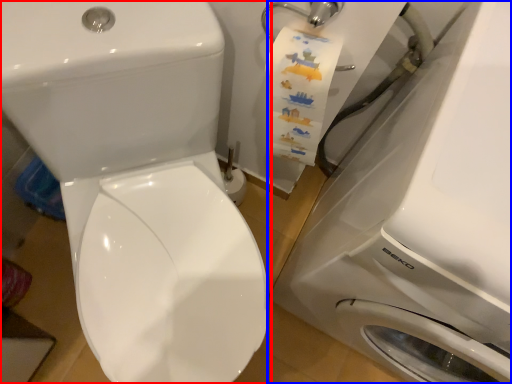
Question: Which object is closer to the camera taking this photo, toilet (highlighted by a red box) or washing machine (highlighted by a blue box)?

Choices:
 (A) toilet
 (B) washing machine

Answer: (B)